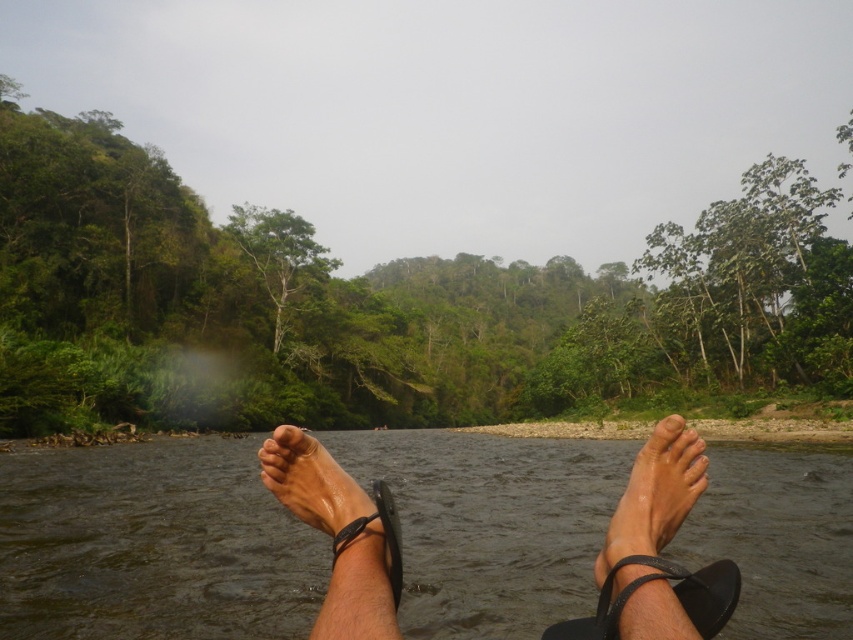
Question: Which point is farther to the camera?

Choices:
 (A) slick black flip-flop at lower center
 (B) green leafy jungle at center
 (C) matte skin toe at center
 (D) brown water at center

Answer: (B)

Question: Does brown water at center appear on the right side of slick black flip-flop at lower center?

Choices:
 (A) yes
 (B) no

Answer: (B)

Question: Which point is farther from the camera taking this photo?

Choices:
 (A) (674, 413)
 (B) (782, 486)
 (C) (751, 317)
 (D) (583, 621)

Answer: (C)

Question: From the image, what is the correct spatial relationship of slick black flip-flop at lower center in relation to dry skin foot at lower center?

Choices:
 (A) right
 (B) left

Answer: (B)

Question: Estimate the real-world distances between objects in this image. Which object is closer to the dry skin foot at lower center?

Choices:
 (A) green leafy jungle at center
 (B) matte skin toe at center

Answer: (B)

Question: Is slick black flip-flop at lower center smaller than dry skin foot at lower center?

Choices:
 (A) yes
 (B) no

Answer: (A)